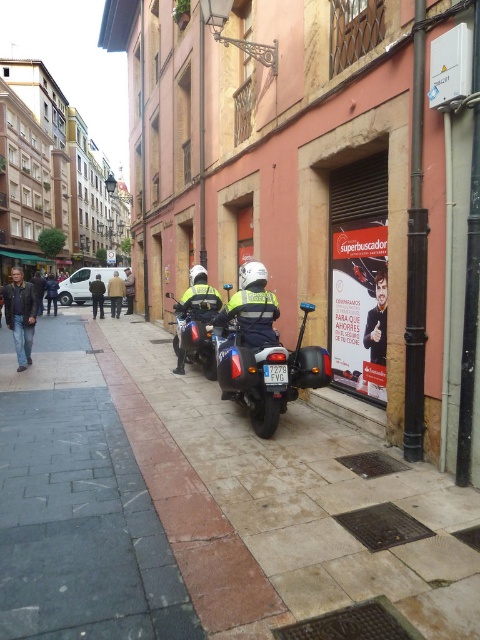
You are a delivery robot that is 1.2 meters wide. You are positioned at the camera location and need to move along the street. Can you fit through the space between the paved stone sidewalk at center and the nearest building without hitting anything?

The distance between the paved stone sidewalk at center and the camera is 2.43 meters. Since the robot is 1.2 meters wide, it can fit through the space as the width available is double the robot width.

You are a pedestrian standing at the center of the street. You need to reach the light brown leather jacket at center before the metallic silver motorcycle at center arrives. Which one will arrive first?

The metallic silver motorcycle at center is 51.77 feet away from the light brown leather jacket at center. Since you are a pedestrian, you can move towards the jacket while the motorcycle is approaching. However, without knowing their respective speeds, it is impossible to determine who will arrive first. Please provide more information about their speeds to make an accurate prediction.